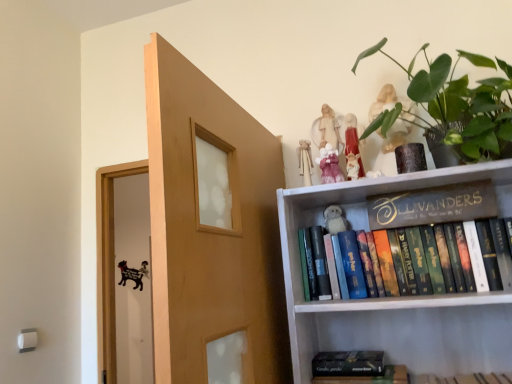
Question: Is hardcover books at upper right, positioned as the 2th book in top-to-bottom order, situated inside hardcover book at lower center, the 1th book when ordered from bottom to top, or outside?

Choices:
 (A) inside
 (B) outside

Answer: (B)

Question: Is point (393, 283) positioned closer to the camera than point (362, 355)?

Choices:
 (A) farther
 (B) closer

Answer: (B)

Question: Estimate the real-world distances between objects in this image. Which object is closer to the hardcover book at lower center, the third book from the top?

Choices:
 (A) pink fabric doll at upper center, which appears as the third toy when viewed from the back
 (B) gold metallic sign at upper right, the third book from the bottom
 (C) white plush toy at upper center, acting as the 4th toy starting from the front
 (D) hardcover books at upper right, which is the 2th book in bottom-to-top order
 (E) matte white figurine at upper center, arranged as the second toy when viewed from the back

Answer: (D)

Question: Which object is positioned farthest from the pink fabric doll at upper center, which appears as the third toy when viewed from the back?

Choices:
 (A) green leafy plant at upper right
 (B) matte white figurine at upper center, arranged as the second toy when viewed from the back
 (C) matte pink figurine at upper center, the fourth toy in the back-to-front sequence
 (D) white plush toy at upper center, arranged as the 1th toy when viewed from the back
 (E) gold metallic sign at upper right, the 1th book when ordered from top to bottom

Answer: (A)